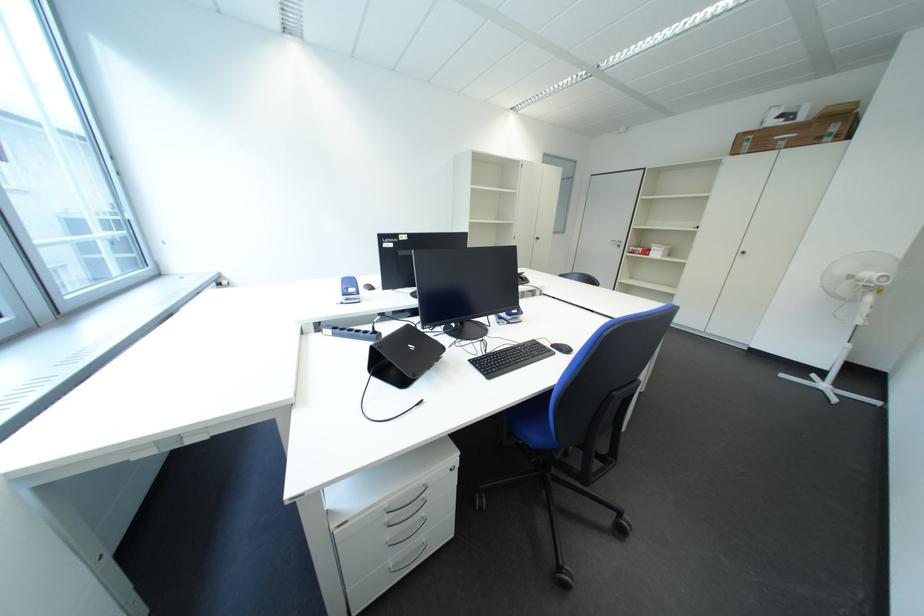
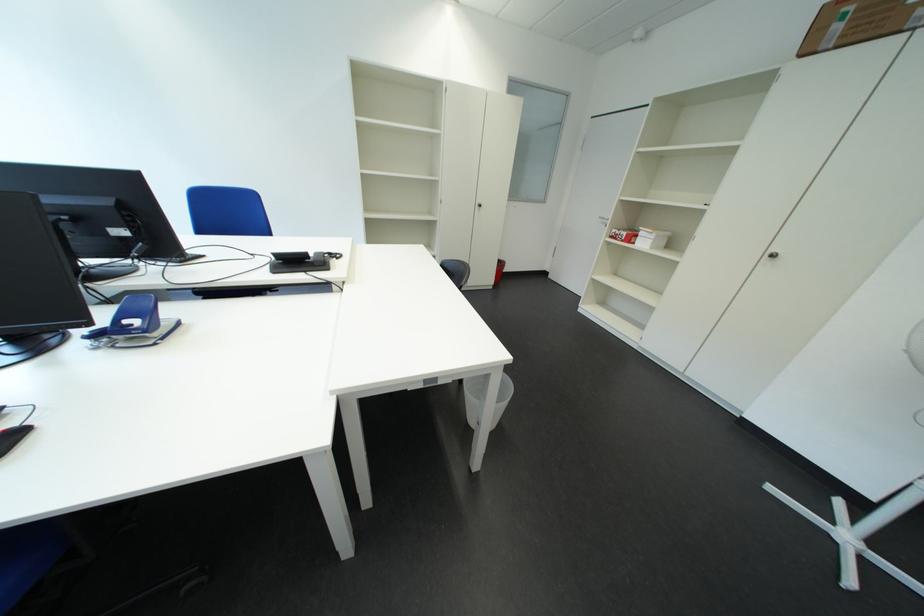
Find the pixel in the second image that matches (x=759, y=147) in the first image.

(849, 30)